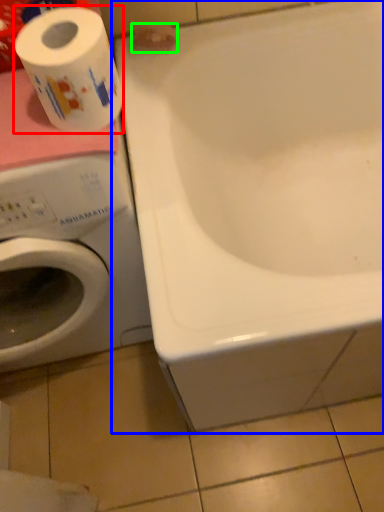
Question: Based on their relative distances, which object is farther from toilet paper (highlighted by a red box)? Choose from bathtub (highlighted by a blue box) and toilet paper (highlighted by a green box).

Choices:
 (A) bathtub
 (B) toilet paper

Answer: (A)